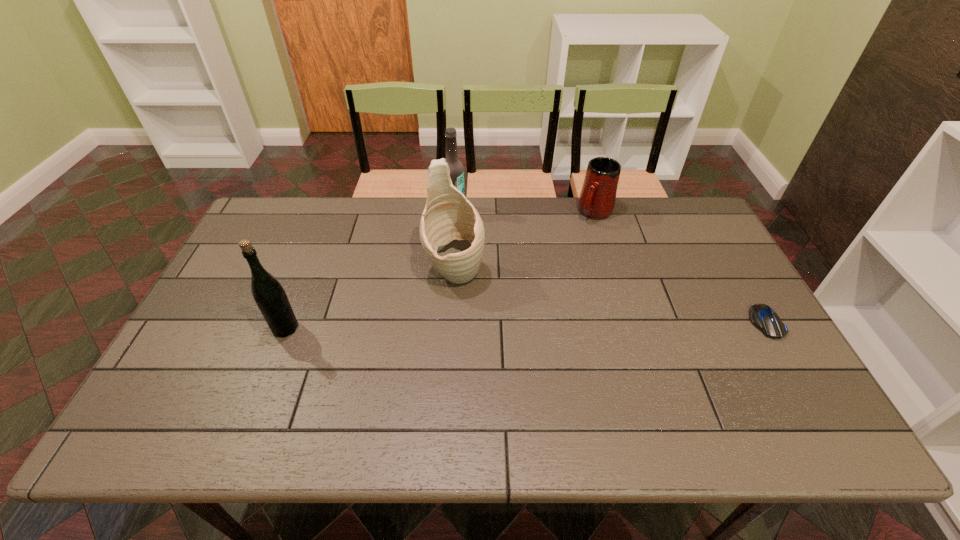
Where is `the leftmost object`? Image resolution: width=960 pixels, height=540 pixels. the leftmost object is located at coordinates click(269, 295).

At what (x,y) coordinates should I click in order to perform the action: click on the left beer bottle. Please return your answer as a coordinate pair (x, y). This screenshot has height=540, width=960. Looking at the image, I should click on (269, 295).

Locate an element on the screen. Image resolution: width=960 pixels, height=540 pixels. computer mouse is located at coordinates (763, 317).

Locate an element on the screen. Image resolution: width=960 pixels, height=540 pixels. the rightmost object is located at coordinates 763,317.

Find the location of a particular element. The width and height of the screenshot is (960, 540). the farther beer bottle is located at coordinates (456, 168).

Find the location of a particular element. The width and height of the screenshot is (960, 540). mug is located at coordinates (597, 199).

Where is `the fourth object from left to right`? The image size is (960, 540). the fourth object from left to right is located at coordinates (597, 199).

In order to click on the tallest object in this screenshot , I will do `click(452, 234)`.

Find the location of `the third nearest object`. the third nearest object is located at coordinates (452, 234).

Where is `free region located on the right of the leftmost object`? free region located on the right of the leftmost object is located at coordinates (340, 328).